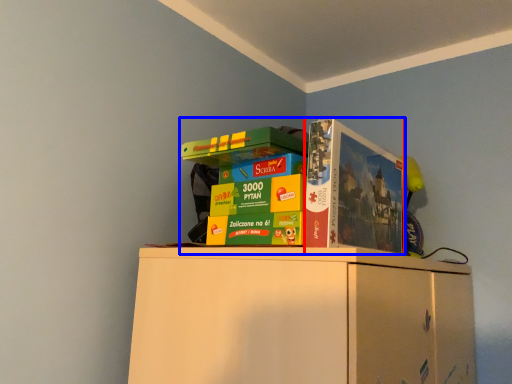
Question: Which of the following is the closest to the observer, paperback book (highlighted by a red box) or collection (highlighted by a blue box)?

Choices:
 (A) paperback book
 (B) collection

Answer: (B)